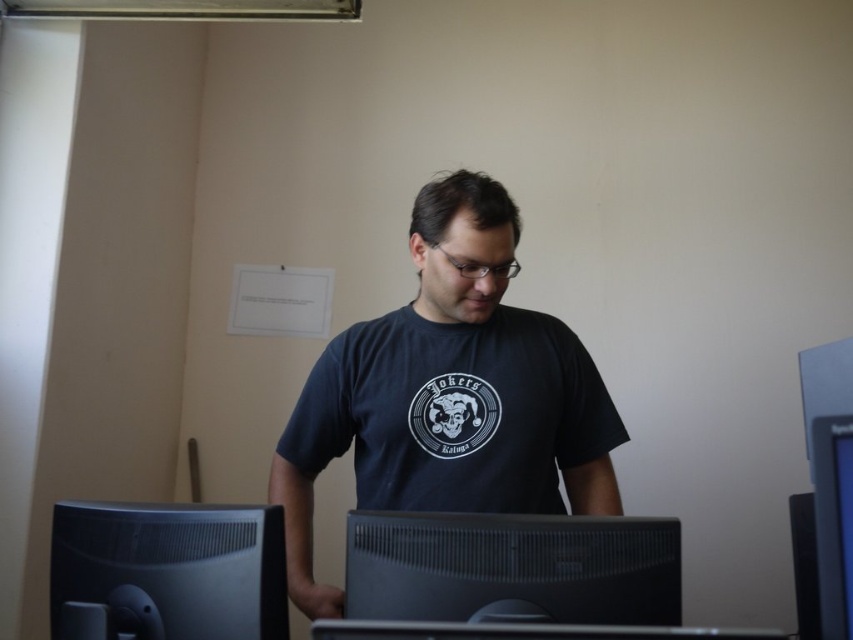
You are a delivery person who needs to place a new monitor between the black plastic monitor at center and the black matte computer monitor at lower left. Can you fit it there?

The black plastic monitor at center is to the right of the black matte computer monitor at lower left, so there is space between them. However, the description does not provide information about the distance between the two monitors. Without knowing the exact spacing, it is impossible to determine if the new monitor will fit.

You are a delivery person standing at the entrance of the room. You need to place a package on the desk where the man is working. The package must be placed exactly at the point specified by the coordinates point (579, 376). However, you have a 1.50 meter long measuring tape. Can you reach that point with your tape measure?

The point (579, 376) is 1.40 meters from the camera. Since your measuring tape is 1.50 meters long, you can reach that point because 1.50 meters is longer than 1.40 meters.